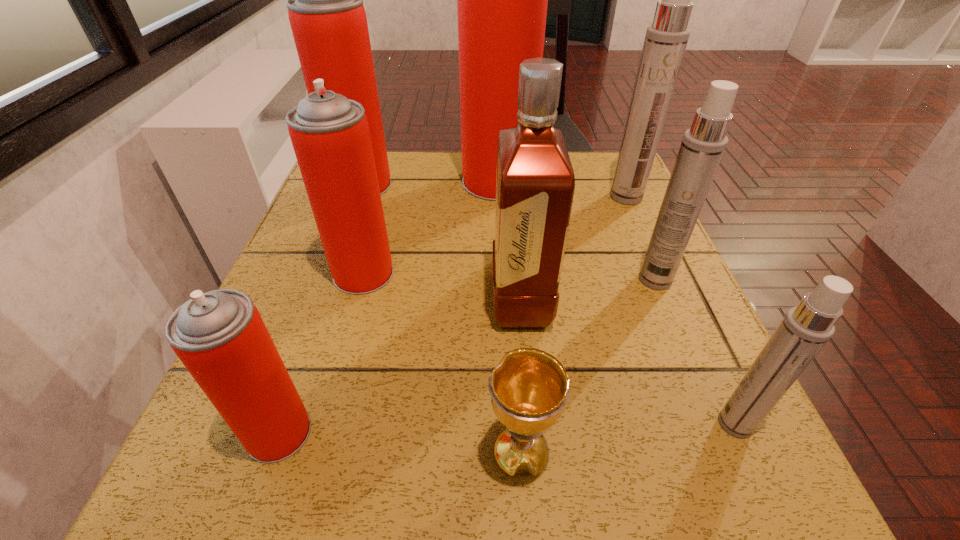
Find the location of a particular element. The image size is (960, 540). vacant area situated on the left of the smallest white aerosol can is located at coordinates point(605,424).

The width and height of the screenshot is (960, 540). In order to click on free space located on the right of the chalice in this screenshot , I will do `click(705, 455)`.

Where is `aerosol can present at the near edge`? Image resolution: width=960 pixels, height=540 pixels. aerosol can present at the near edge is located at coordinates (220, 337).

In order to click on chalice at the near edge in this screenshot , I will do `click(529, 387)`.

Locate an element on the screen. The height and width of the screenshot is (540, 960). object located in the far left corner section of the desktop is located at coordinates (325, 6).

Where is `object that is at the near left corner`? This screenshot has height=540, width=960. object that is at the near left corner is located at coordinates (220, 337).

Where is `object situated at the far right corner`? Image resolution: width=960 pixels, height=540 pixels. object situated at the far right corner is located at coordinates (666, 39).

Where is `free region at the far edge`? free region at the far edge is located at coordinates (462, 152).

Identify the location of free location at the near edge. The width and height of the screenshot is (960, 540). (385, 455).

The height and width of the screenshot is (540, 960). What are the coordinates of `vacant space at the left edge of the desktop` in the screenshot? It's located at (319, 378).